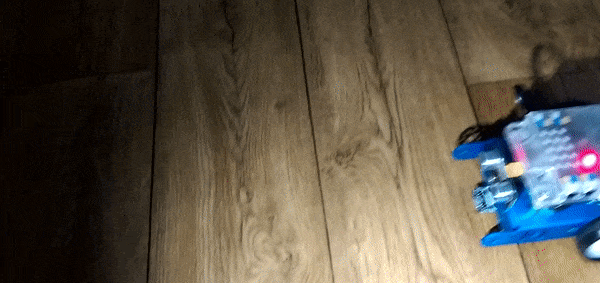
This screenshot has width=600, height=283. I want to click on remote screen, so click(56, 214).